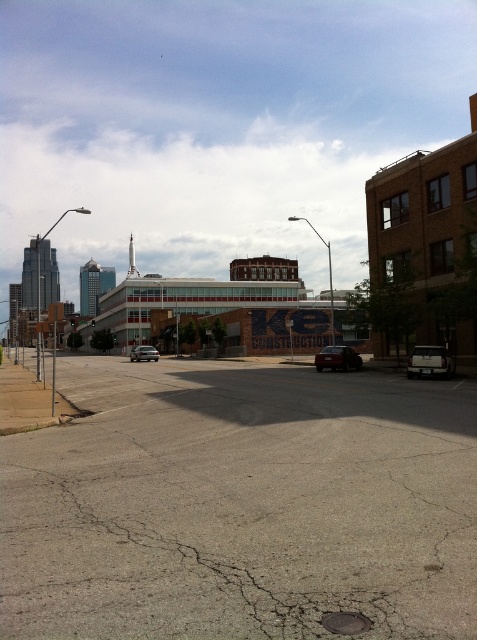
Question: Is matte black car at center bigger than shiny red sedan at center?

Choices:
 (A) no
 (B) yes

Answer: (A)

Question: Which object is closer to the camera taking this photo?

Choices:
 (A) shiny red sedan at center
 (B) asphalt road at center
 (C) satin silver sedan at center

Answer: (B)

Question: Can you confirm if matte black car at center is smaller than satin silver sedan at center?

Choices:
 (A) yes
 (B) no

Answer: (A)

Question: Which point is farther to the camera?

Choices:
 (A) satin silver sedan at center
 (B) asphalt road at center

Answer: (A)

Question: Is matte black car at center thinner than shiny red sedan at center?

Choices:
 (A) no
 (B) yes

Answer: (B)

Question: Which of the following is the farthest from the observer?

Choices:
 (A) matte black car at center
 (B) shiny red sedan at center
 (C) asphalt road at center
 (D) satin silver sedan at center

Answer: (D)